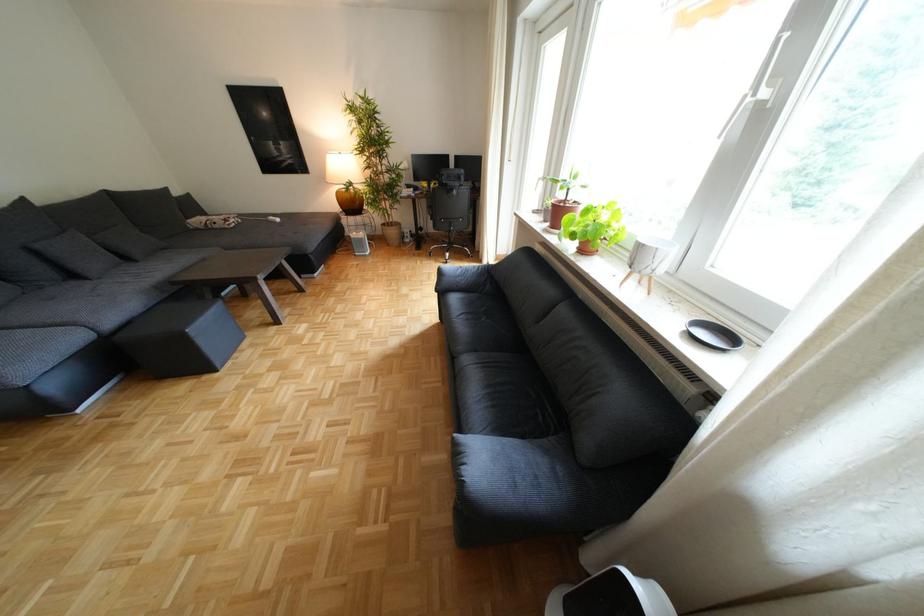
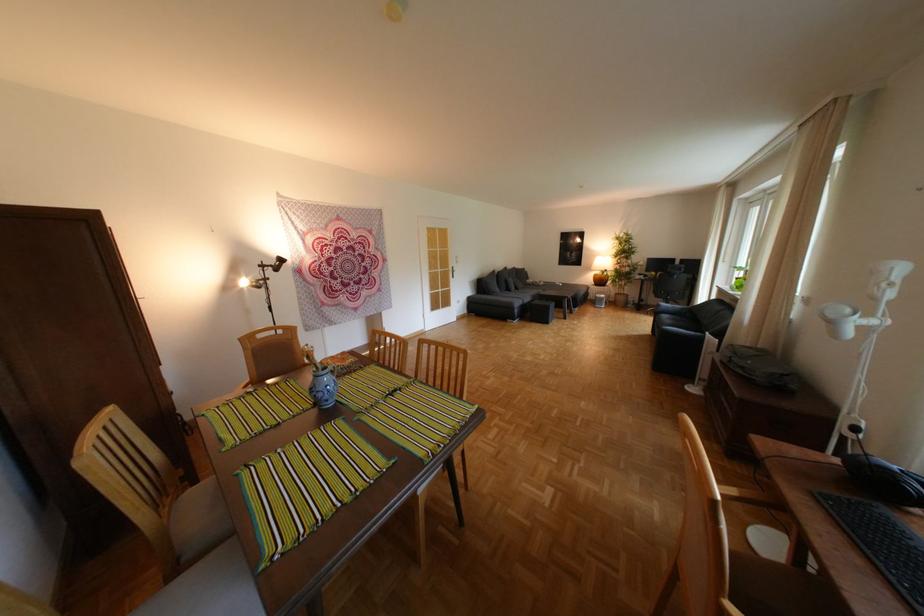
Locate, in the second image, the point that corresponds to pixel 65 387 in the first image.

(529, 312)